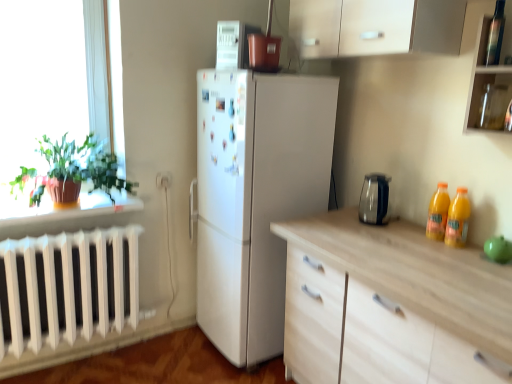
This screenshot has width=512, height=384. I want to click on yellow glass bottles at right, the first bottle ordered from the bottom, so click(x=458, y=219).

This screenshot has height=384, width=512. In order to click on white plastic electric outlet at lower center in this screenshot , I will do click(163, 180).

What do you see at coordinates (488, 99) in the screenshot? I see `transparent glass jar at upper right` at bounding box center [488, 99].

In order to face white glossy microwave at upper center, should I rotate leftwards or rightwards?

Rotate your view left by about 2.479°.

Locate an element on the screen. The image size is (512, 384). yellow glass bottles at right, the 3th bottle in the top-to-bottom sequence is located at coordinates (458, 219).

In terms of height, does transparent plastic bottle at upper right, placed as the 3th bottle when sorted from bottom to top, look taller or shorter compared to white matte refrigerator at center?

In the image, transparent plastic bottle at upper right, placed as the 3th bottle when sorted from bottom to top, appears to be shorter than white matte refrigerator at center.

Is white matte refrigerator at center a part of transparent plastic bottle at upper right, which appears as the 1th bottle when viewed from the top?

That's incorrect, white matte refrigerator at center is not inside transparent plastic bottle at upper right, which appears as the 1th bottle when viewed from the top.

Which is farther from the camera, (503, 32) or (245, 210)?

The point (245, 210) is farther.

In the scene shown: From a real-world perspective, which object stands above the other?

transparent plastic bottle at upper right, which appears as the 1th bottle when viewed from the top, is physically above.

Is transparent plastic bottle at upper right, placed as the 3th bottle when sorted from bottom to top, wider than transparent glass cabinet at upper right?

Incorrect, the width of transparent plastic bottle at upper right, placed as the 3th bottle when sorted from bottom to top, does not surpass that of transparent glass cabinet at upper right.

Does transparent plastic bottle at upper right, which appears as the 1th bottle when viewed from the top, turn towards transparent glass cabinet at upper right?

Yes, transparent plastic bottle at upper right, which appears as the 1th bottle when viewed from the top, is turned towards transparent glass cabinet at upper right.

Considering the relative positions of yellow glass bottles at right, the second bottle in the back-to-front sequence, and transparent glass jar at upper right in the image provided, is yellow glass bottles at right, the second bottle in the back-to-front sequence, to the left or to the right of transparent glass jar at upper right?

From the image, it's evident that yellow glass bottles at right, the second bottle in the back-to-front sequence, is to the left of transparent glass jar at upper right.

From a real-world perspective, relative to transparent glass jar at upper right, is yellow glass bottles at right, the first bottle ordered from the bottom, vertically above or below?

yellow glass bottles at right, the first bottle ordered from the bottom, is situated lower than transparent glass jar at upper right in the real world.

In the scene shown: Is yellow glass bottles at right, which is the second bottle from front to back, thinner than transparent glass jar at upper right?

Yes, yellow glass bottles at right, which is the second bottle from front to back, is thinner than transparent glass jar at upper right.

Is yellow glass bottles at right, the second bottle in the back-to-front sequence, oriented towards transparent glass jar at upper right?

No.

Is point (203, 89) closer or farther from the camera than point (240, 35)?

Point (203, 89).

In the image, is white matte refrigerator at center on the left side or the right side of white glossy microwave at upper center?

From the image, it's evident that white matte refrigerator at center is to the left of white glossy microwave at upper center.

From the image's perspective, who appears lower, white matte refrigerator at center or white glossy microwave at upper center?

From the image's view, white matte refrigerator at center is below.

Are yellow glass bottles at right, which is the second bottle from front to back, and orange plastic bottles at right, which is counted as the 2th bottle, starting from the top, far apart?

yellow glass bottles at right, which is the second bottle from front to back, is actually quite close to orange plastic bottles at right, which is counted as the 2th bottle, starting from the top.

Based on their positions, is yellow glass bottles at right, the 3th bottle in the top-to-bottom sequence, located to the left or right of orange plastic bottles at right, which is counted as the 2th bottle, starting from the top?

yellow glass bottles at right, the 3th bottle in the top-to-bottom sequence, is positioned on orange plastic bottles at right, which is counted as the 2th bottle, starting from the top,'s right side.

In terms of size, does yellow glass bottles at right, the second bottle in the back-to-front sequence, appear bigger or smaller than orange plastic bottles at right, which is the third bottle from front to back?

Clearly, yellow glass bottles at right, the second bottle in the back-to-front sequence, is larger in size than orange plastic bottles at right, which is the third bottle from front to back.

Would you consider transparent plastic bottle at upper right, which appears as the 1th bottle when viewed from the front, to be distant from green matte plant at left?

Yes, transparent plastic bottle at upper right, which appears as the 1th bottle when viewed from the front, is far from green matte plant at left.

Locate an element on the screen. bottle above the green matte plant at left (from the image's perspective) is located at coordinates (495, 35).

Considering the positions of objects transparent plastic bottle at upper right, which appears as the 1th bottle when viewed from the top, and green matte plant at left in the image provided, who is more to the left, transparent plastic bottle at upper right, which appears as the 1th bottle when viewed from the top, or green matte plant at left?

green matte plant at left is more to the left.

Is transparent plastic bottle at upper right, which appears as the 1th bottle when viewed from the front, inside or outside of green matte plant at left?

transparent plastic bottle at upper right, which appears as the 1th bottle when viewed from the front, cannot be found inside green matte plant at left.

From the image's perspective, is transparent glass cabinet at upper right located above or below white glossy microwave at upper center?

Based on their image positions, transparent glass cabinet at upper right is located beneath white glossy microwave at upper center.

What's the angular difference between transparent glass cabinet at upper right and white glossy microwave at upper center's facing directions?

24.5 degrees separate the facing orientations of transparent glass cabinet at upper right and white glossy microwave at upper center.

Can you confirm if transparent glass cabinet at upper right is bigger than white glossy microwave at upper center?

Yes.

Locate an element on the screen. This screenshot has width=512, height=384. screen door that appears behind the transparent plastic bottle at upper right, which ranks as the third bottle in back-to-front order is located at coordinates tap(225, 149).

You are a GUI agent. You are given a task and a screenshot of the screen. Output one action in this format:
    pyautogui.click(x=<x>, y=<y>)
    Task: Click on the cabinetry on the right of the transparent plastic bottle at upper right, which appears as the 1th bottle when viewed from the front
    
    Given the screenshot: What is the action you would take?
    pyautogui.click(x=490, y=78)

Considering their positions, is yellow glass bottles at right, the first bottle ordered from the bottom, positioned further to transparent glass jar at upper right than white plastic electric outlet at lower center?

white plastic electric outlet at lower center is positioned further to the anchor transparent glass jar at upper right.

Considering their positions, is transparent glass cabinet at upper right positioned further to white plastic electric outlet at lower center than transparent plastic bottle at upper right, which appears as the 1th bottle when viewed from the front?

Among the two, transparent plastic bottle at upper right, which appears as the 1th bottle when viewed from the front, is located further to white plastic electric outlet at lower center.

From the image, which object appears to be nearer to white matte refrigerator at center, transparent plastic bottle at upper right, which appears as the 1th bottle when viewed from the top, or white glossy microwave at upper center?

white glossy microwave at upper center is closer to white matte refrigerator at center.

Estimate the real-world distances between objects in this image. Which object is further from white plastic electric outlet at lower center, transparent plastic bottle at upper right, which appears as the 1th bottle when viewed from the top, or transparent glass jar at upper right?

transparent plastic bottle at upper right, which appears as the 1th bottle when viewed from the top, lies further to white plastic electric outlet at lower center than the other object.

Estimate the real-world distances between objects in this image. Which object is closer to transparent plastic bottle at upper right, which ranks as the third bottle in back-to-front order, white plastic electric outlet at lower center or white glossy microwave at upper center?

Among the two, white glossy microwave at upper center is located nearer to transparent plastic bottle at upper right, which ranks as the third bottle in back-to-front order.

When comparing their distances from transparent plastic bottle at upper right, which appears as the 1th bottle when viewed from the top, does white matte refrigerator at center or green matte plant at left seem further?

Based on the image, green matte plant at left appears to be further to transparent plastic bottle at upper right, which appears as the 1th bottle when viewed from the top.

In the scene shown: When comparing their distances from orange plastic bottles at right, which is the third bottle from front to back, does white plastic electric outlet at lower center or yellow glass bottles at right, the 3th bottle in the top-to-bottom sequence, seem further?

Among the two, white plastic electric outlet at lower center is located further to orange plastic bottles at right, which is the third bottle from front to back.

When comparing their distances from transparent plastic bottle at upper right, placed as the 3th bottle when sorted from bottom to top, does yellow glass bottles at right, which is the second bottle from front to back, or white matte refrigerator at center seem further?

white matte refrigerator at center lies further to transparent plastic bottle at upper right, placed as the 3th bottle when sorted from bottom to top, than the other object.

Identify the location of screen door located between white plastic electric outlet at lower center and yellow glass bottles at right, the second bottle in the back-to-front sequence, in the left-right direction. (225, 149).

Where is `shelf between transparent plastic bottle at upper right, which appears as the 1th bottle when viewed from the top, and orange plastic bottles at right, which is counted as the 2th bottle, starting from the top, in the up-down direction`? The height and width of the screenshot is (384, 512). shelf between transparent plastic bottle at upper right, which appears as the 1th bottle when viewed from the top, and orange plastic bottles at right, which is counted as the 2th bottle, starting from the top, in the up-down direction is located at coordinates (488, 99).

This screenshot has width=512, height=384. Find the location of `screen door between green matte plant at left and orange plastic bottles at right, which is counted as the 2th bottle, starting from the top, in the horizontal direction`. screen door between green matte plant at left and orange plastic bottles at right, which is counted as the 2th bottle, starting from the top, in the horizontal direction is located at coordinates (225, 149).

I want to click on bottle between white glossy microwave at upper center and yellow glass bottles at right, the 3th bottle in the top-to-bottom sequence, in the horizontal direction, so click(438, 213).